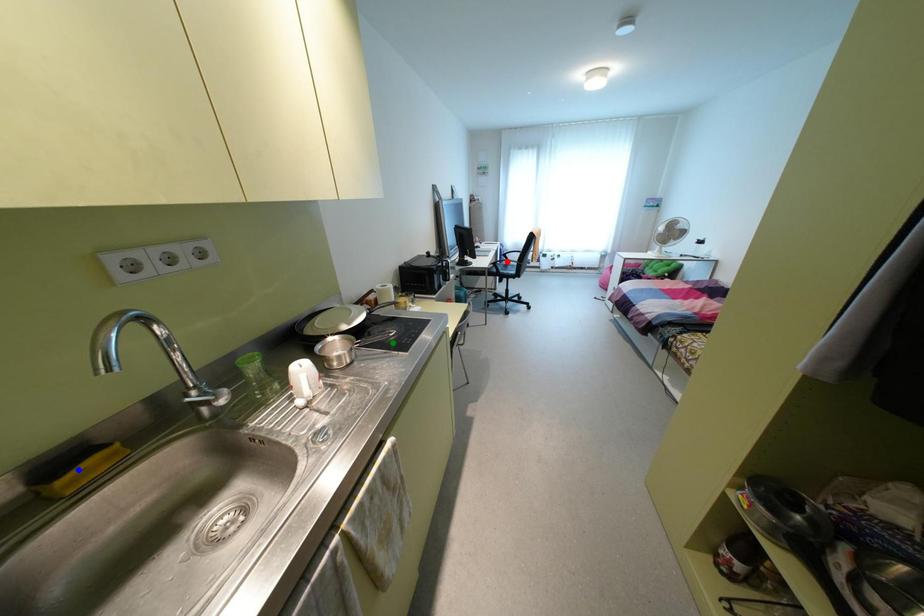
Order these from nearest to farthest:
1. red point
2. green point
3. blue point

red point < green point < blue point